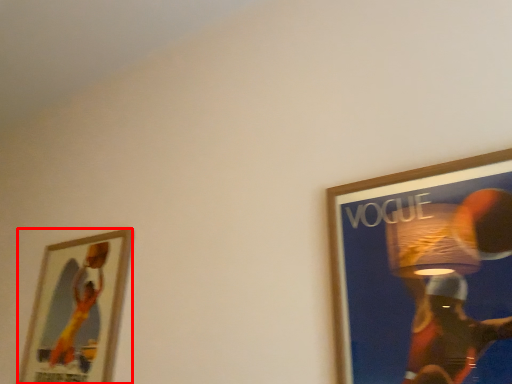
Question: From the image, what is the correct spatial relationship of picture frame (annotated by the red box) in relation to picture frame?

Choices:
 (A) left
 (B) right

Answer: (A)